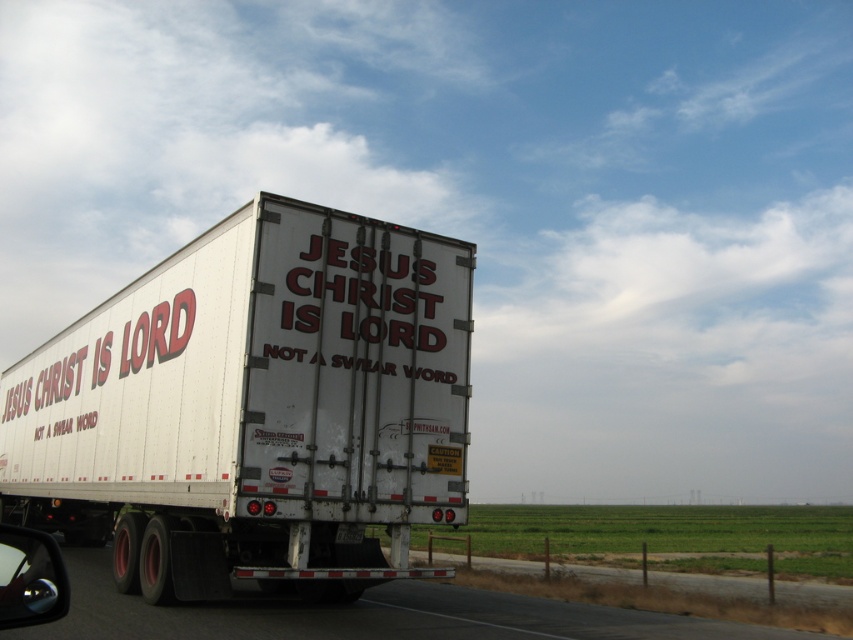
Can you confirm if metallic gray highway at lower center is shorter than shiny chrome side mirror at lower left?

Yes.

Can you confirm if metallic gray highway at lower center is smaller than shiny chrome side mirror at lower left?

Incorrect, metallic gray highway at lower center is not smaller in size than shiny chrome side mirror at lower left.

Is point (469, 593) closer to camera compared to point (67, 605)?

No, (469, 593) is behind (67, 605).

The height and width of the screenshot is (640, 853). Find the location of `metallic gray highway at lower center`. metallic gray highway at lower center is located at coordinates (364, 614).

Is white matte trailer truck at center to the left of metallic gray highway at lower center from the viewer's perspective?

Yes, white matte trailer truck at center is to the left of metallic gray highway at lower center.

Can you confirm if white matte trailer truck at center is positioned above metallic gray highway at lower center?

Indeed, white matte trailer truck at center is positioned over metallic gray highway at lower center.

The width and height of the screenshot is (853, 640). I want to click on white matte trailer truck at center, so click(254, 406).

Which is in front, point (236, 524) or point (48, 573)?

Point (48, 573) is more forward.

Looking at this image, between white matte trailer truck at center and shiny chrome side mirror at lower left, which one has more height?

white matte trailer truck at center is taller.

What are the coordinates of `white matte trailer truck at center` in the screenshot? It's located at (254, 406).